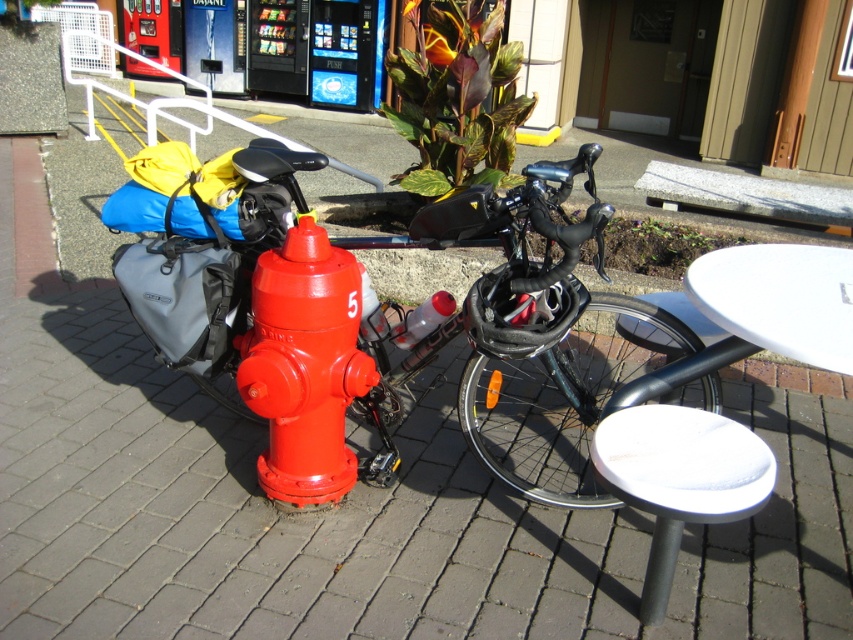
You are a delivery person with a package that needs to be placed on the table. The package is 90 centimeters long. Can you place the package horizontally between the glossy red fire hydrant at center and the white glossy table at lower right without moving either object?

The distance between the glossy red fire hydrant at center and the white glossy table at lower right is 86.25 centimeters. Since the package is 90 centimeters long, it is longer than the available space. Therefore, you cannot place the package horizontally between them without moving either object.

You are a painter who needs to paint the glossy red fire hydrant at center and the white glossy table at lower right. Which object requires more paint to cover its height?

The glossy red fire hydrant at center requires more paint to cover its height because it is taller than the white glossy table at lower right.

You are standing at the point marked by the coordinates point [408,339]. Looking around, you see a red fire hydrant marked with the number 5 in white paint. Can you tell me what object is located exactly at your current position?

The point [408,339] indicates the location of the shiny black bicycle at center.